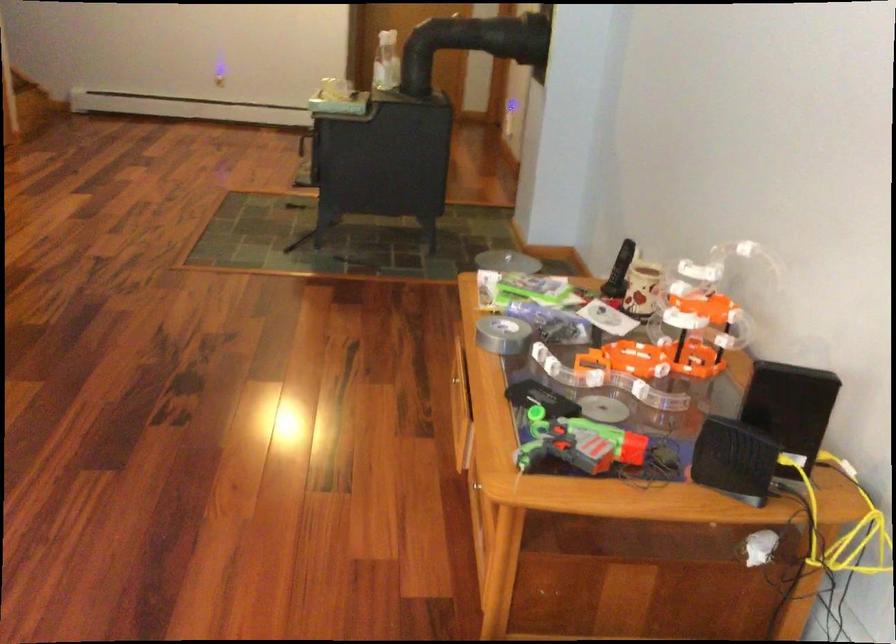
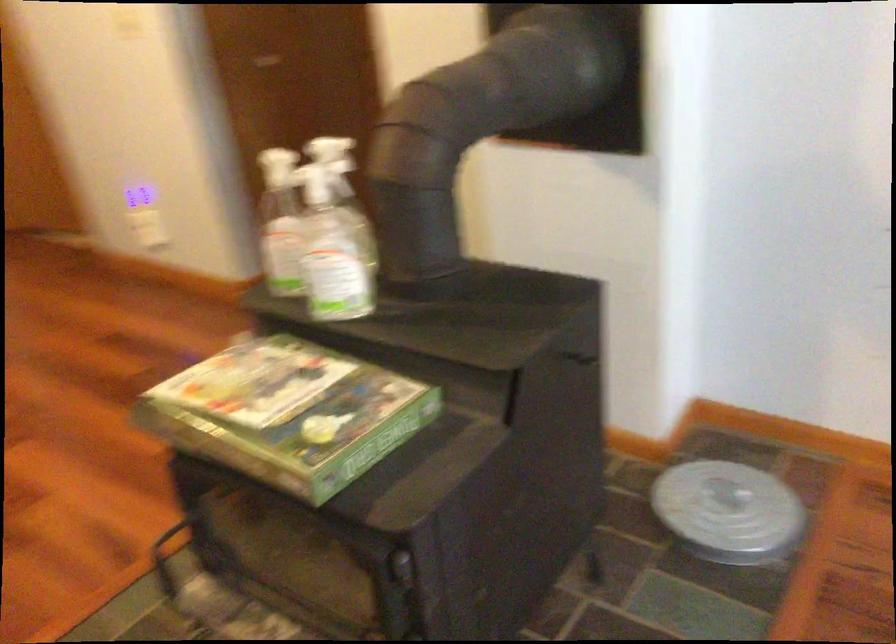
Find the pixel in the second image that matches pixel 330 98 in the first image.

(289, 413)